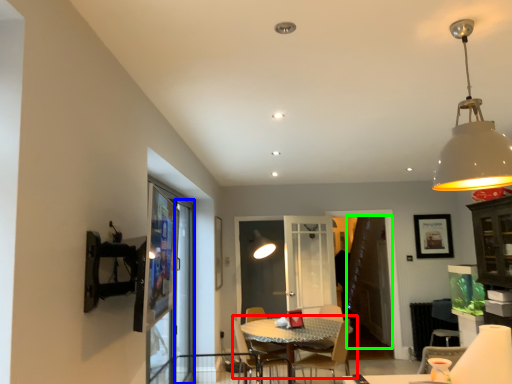
Question: Based on their relative distances, which object is farther from table (highlighted by a red box)? Choose from screen door (highlighted by a blue box) and screen door (highlighted by a green box).

Choices:
 (A) screen door
 (B) screen door

Answer: (B)